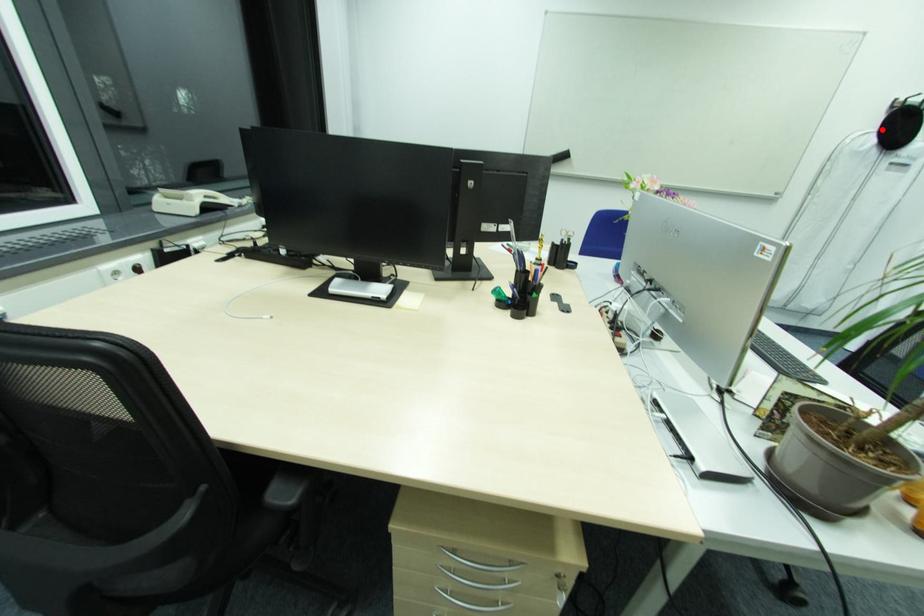
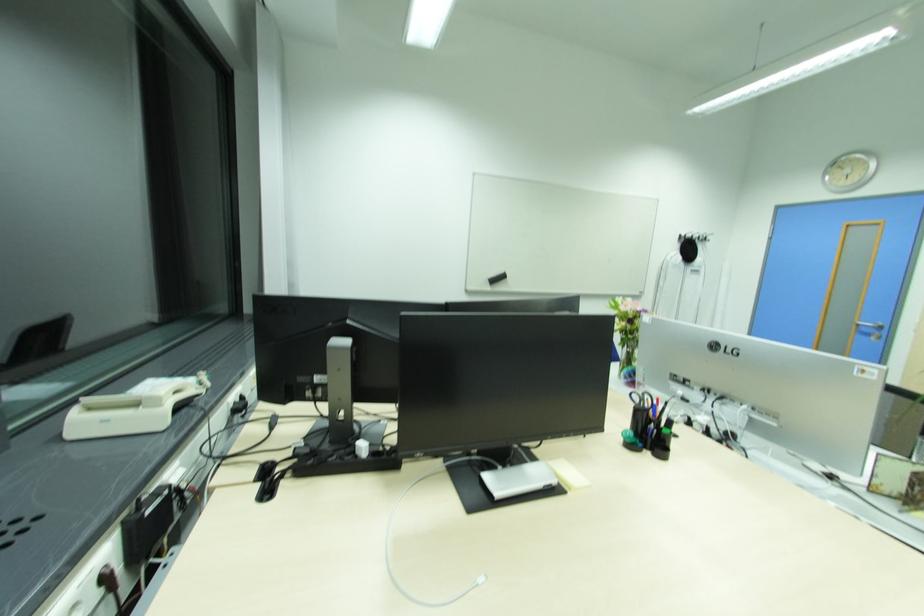
Question: I am providing you with two images of the same scene from different viewpoints. Given a red point in image1, look at the same physical point in image2. Is it:

Choices:
 (A) Closer to the viewpoint
 (B) Farther from the viewpoint

Answer: (A)